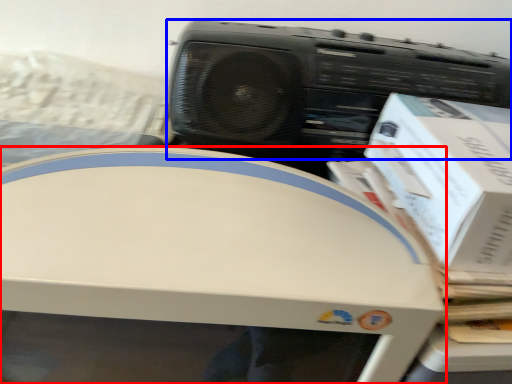
Question: Which point is closer to the camera, home appliance (highlighted by a red box) or cassette (highlighted by a blue box)?

Choices:
 (A) home appliance
 (B) cassette

Answer: (A)